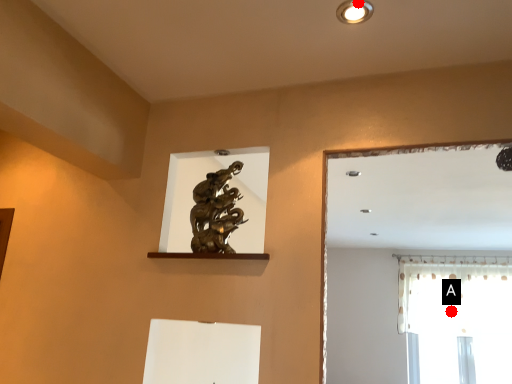
Question: Two points are circled on the image, labeled by A and B beside each circle. Which of the following is the farthest from the observer?

Choices:
 (A) A is further
 (B) B is further

Answer: (A)